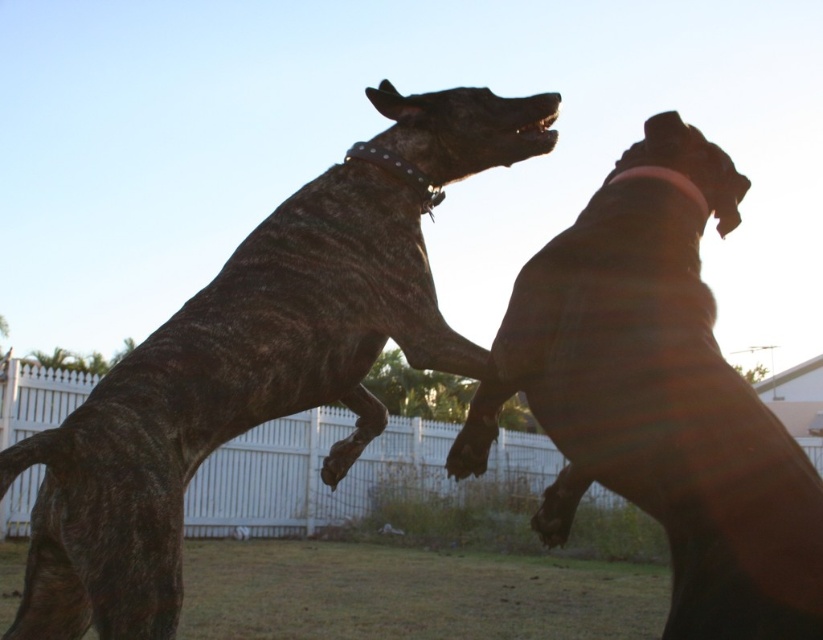
Question: Is the position of speckled fur dog at upper center more distant than that of white picket fence at center?

Choices:
 (A) no
 (B) yes

Answer: (A)

Question: Which object appears closest to the camera in this image?

Choices:
 (A) brown matte dog at upper right
 (B) white picket fence at center

Answer: (A)

Question: In this image, where is brown matte dog at upper right located relative to white picket fence at center?

Choices:
 (A) above
 (B) below

Answer: (A)

Question: Which point is farther from the camera taking this photo?

Choices:
 (A) (524, 477)
 (B) (659, 481)

Answer: (A)

Question: Can you confirm if brown matte dog at upper right is bigger than white picket fence at center?

Choices:
 (A) no
 (B) yes

Answer: (A)

Question: Which point appears farthest from the camera in this image?

Choices:
 (A) (398, 342)
 (B) (412, 420)
 (C) (732, 195)

Answer: (B)